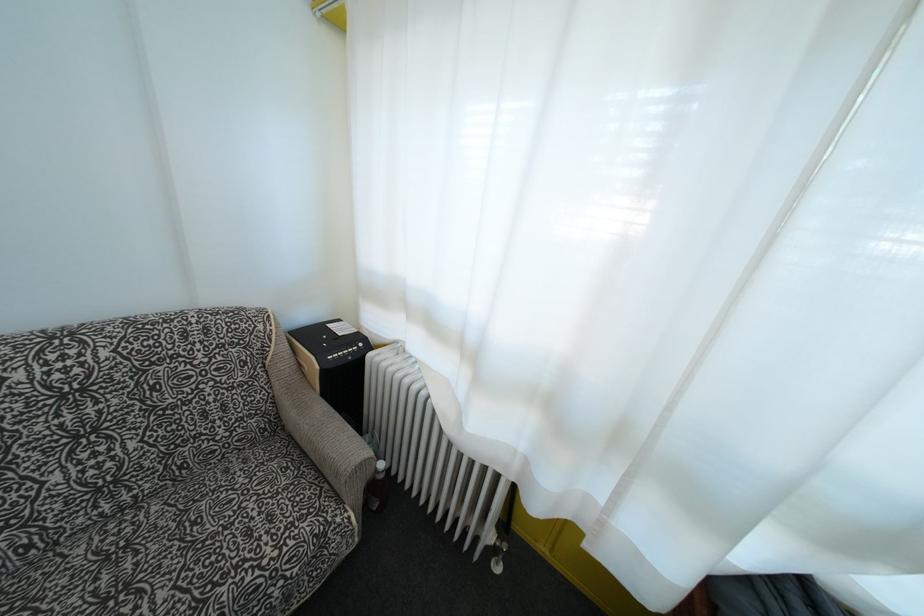
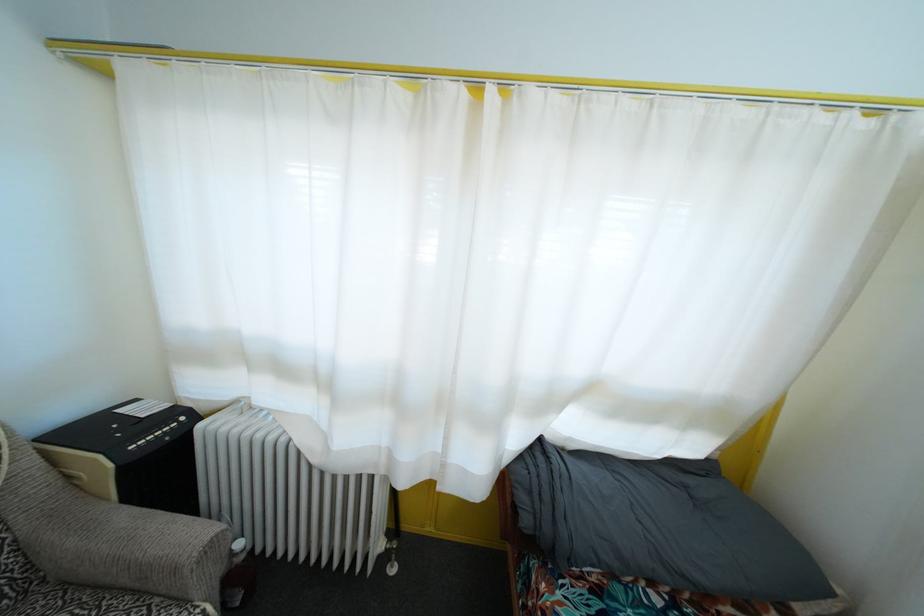
The point at (674, 415) is marked in the first image. Where is the corresponding point in the second image?

(457, 379)